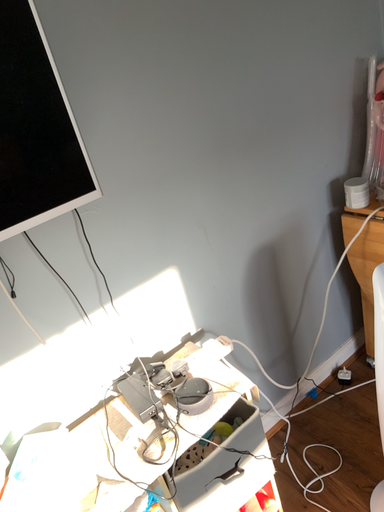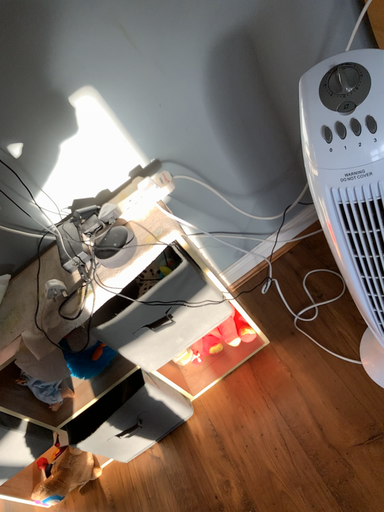
Question: How did the camera likely rotate when shooting the video?

Choices:
 (A) rotated downward
 (B) rotated upward

Answer: (A)